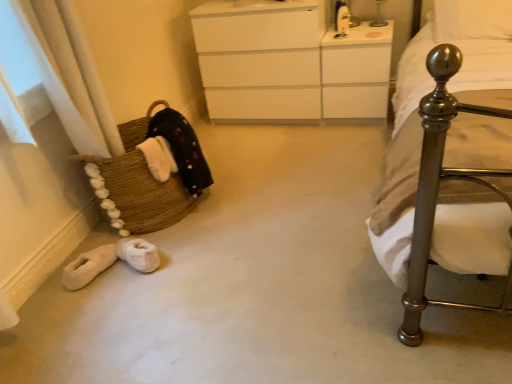
Question: Can you confirm if brown woven basket at left is positioned to the left of polished metal bed at right?

Choices:
 (A) yes
 (B) no

Answer: (A)

Question: Is brown woven basket at left positioned in front of polished metal bed at right?

Choices:
 (A) yes
 (B) no

Answer: (B)

Question: Is brown woven basket at left positioned far away from polished metal bed at right?

Choices:
 (A) no
 (B) yes

Answer: (B)

Question: Is brown woven basket at left looking in the opposite direction of polished metal bed at right?

Choices:
 (A) no
 (B) yes

Answer: (A)

Question: Considering the relative sizes of brown woven basket at left and polished metal bed at right in the image provided, is brown woven basket at left taller than polished metal bed at right?

Choices:
 (A) no
 (B) yes

Answer: (A)

Question: Is metallic glass table lamp at upper center to the left or to the right of brown woven basket at left in the image?

Choices:
 (A) right
 (B) left

Answer: (A)

Question: Is metallic glass table lamp at upper center wider or thinner than brown woven basket at left?

Choices:
 (A) thin
 (B) wide

Answer: (A)

Question: Considering the positions of point (380, 9) and point (111, 178), is point (380, 9) closer or farther from the camera than point (111, 178)?

Choices:
 (A) closer
 (B) farther

Answer: (B)

Question: Would you say metallic glass table lamp at upper center is inside or outside brown woven basket at left?

Choices:
 (A) inside
 (B) outside

Answer: (B)

Question: From a real-world perspective, is white soft pillow at upper right above or below brown woven basket at left?

Choices:
 (A) below
 (B) above

Answer: (B)

Question: From their relative heights in the image, would you say white soft pillow at upper right is taller or shorter than brown woven basket at left?

Choices:
 (A) tall
 (B) short

Answer: (B)

Question: Looking at the image, does white soft pillow at upper right seem bigger or smaller compared to brown woven basket at left?

Choices:
 (A) big
 (B) small

Answer: (B)

Question: Considering the positions of white soft pillow at upper right and brown woven basket at left in the image, is white soft pillow at upper right wider or thinner than brown woven basket at left?

Choices:
 (A) wide
 (B) thin

Answer: (A)

Question: From a real-world perspective, is metallic glass table lamp at upper center physically located above or below polished metal bed at right?

Choices:
 (A) below
 (B) above

Answer: (B)

Question: In terms of height, does metallic glass table lamp at upper center look taller or shorter compared to polished metal bed at right?

Choices:
 (A) tall
 (B) short

Answer: (B)